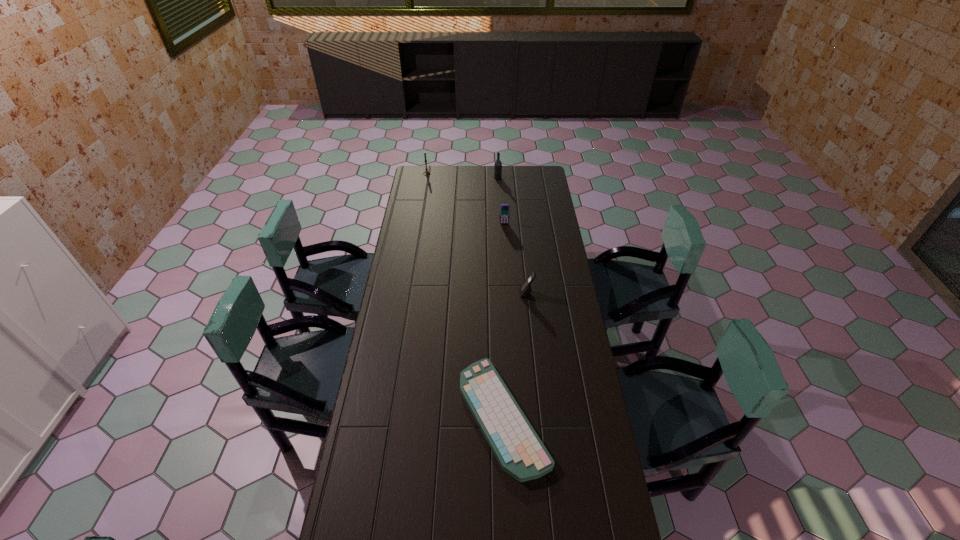
Identify the location of vacant region located on the front of the leftmost object. This screenshot has width=960, height=540. (420, 212).

This screenshot has width=960, height=540. In order to click on vacant region located 0.330m on the front-facing side of the third farthest object in this screenshot , I will do `click(507, 266)`.

Identify the location of free space located 0.230m on the front-facing side of the nearer cellular telephone. (468, 293).

Locate an element on the screen. free space located 0.310m on the front-facing side of the nearer cellular telephone is located at coordinates (451, 293).

You are a GUI agent. You are given a task and a screenshot of the screen. Output one action in this format:
    pyautogui.click(x=<x>, y=<y>)
    Task: Click on the vacant space located 0.190m on the front-facing side of the nearer cellular telephone
    The image size is (960, 540).
    Given the screenshot: What is the action you would take?
    pyautogui.click(x=477, y=293)

I want to click on free space located 0.320m on the left of the shortest object, so click(x=369, y=416).

Locate an element on the screen. vodka positioned at the far edge is located at coordinates (498, 164).

At what (x,y) coordinates should I click in order to perform the action: click on candle situated at the far edge. Please return your answer as a coordinate pair (x, y). Looking at the image, I should click on (426, 172).

You are a GUI agent. You are given a task and a screenshot of the screen. Output one action in this format:
    pyautogui.click(x=<x>, y=<y>)
    Task: Click on the object that is at the left edge
    This screenshot has width=960, height=540.
    Given the screenshot: What is the action you would take?
    pyautogui.click(x=426, y=172)

Identify the location of object at the far left corner. (426, 172).